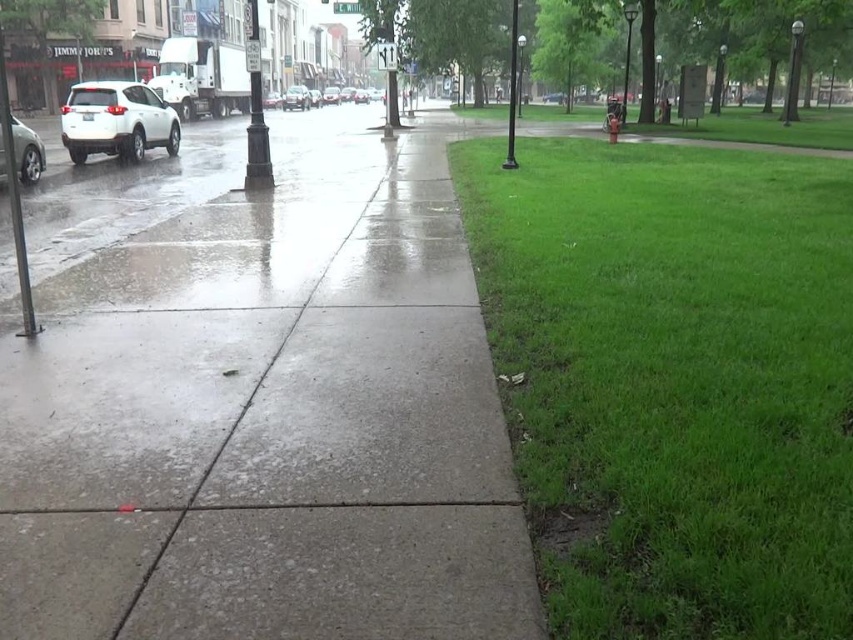
You are a delivery person standing on the concrete sidewalk at center and need to reach the white matte suv at left. Which direction should you walk to get there?

You should walk upwards towards the white matte suv at left because the concrete sidewalk at center is located below it.